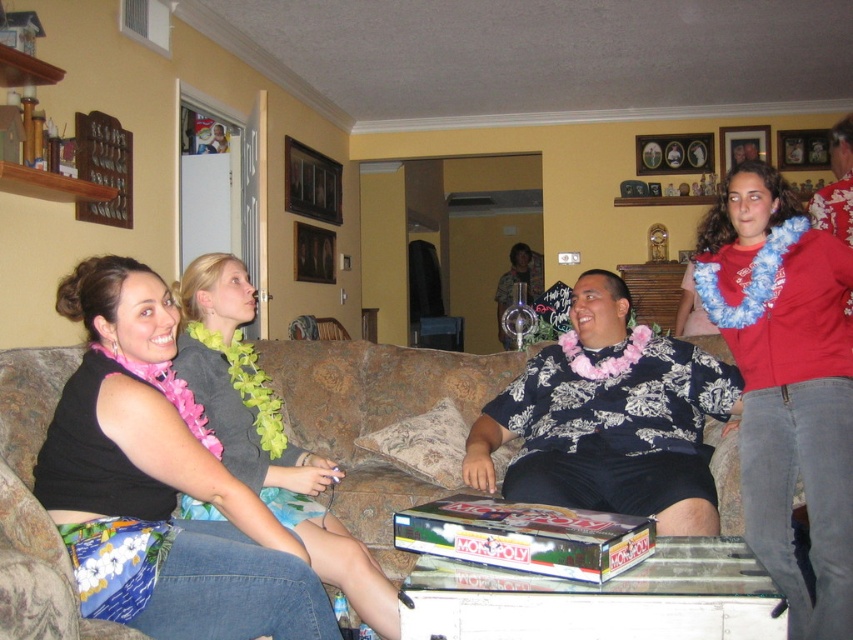
Does point (735, 184) lie in front of point (22, 554)?

No, (735, 184) is further to viewer.

The image size is (853, 640). Identify the location of red fabric lei at right. pos(786,384).

Can you confirm if red fabric lei at right is positioned above pink fabric lei at center?

Yes.

Does red fabric lei at right have a greater width compared to pink fabric lei at center?

In fact, red fabric lei at right might be narrower than pink fabric lei at center.

Identify the location of red fabric lei at right. (786, 384).

Can you confirm if black fabric shirt at left is taller than brown fabric couch at center?

Indeed, black fabric shirt at left has a greater height compared to brown fabric couch at center.

Is black fabric shirt at left wider than brown fabric couch at center?

No, black fabric shirt at left is not wider than brown fabric couch at center.

The image size is (853, 640). What are the coordinates of `black fabric shirt at left` in the screenshot? It's located at (160, 483).

At what (x,y) coordinates should I click in order to perform the action: click on black fabric shirt at left. Please return your answer as a coordinate pair (x, y). The width and height of the screenshot is (853, 640). Looking at the image, I should click on (160, 483).